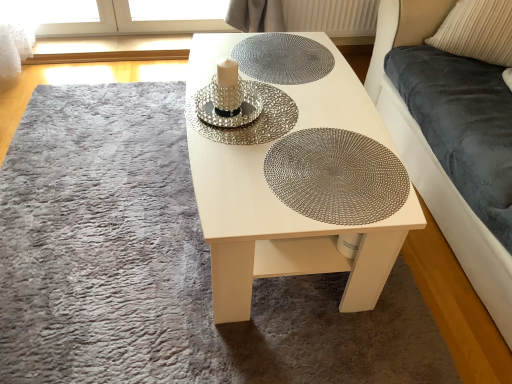
Locate an element on the screen. empty space that is ontop of silver metallic plate at center, the second glass plate from the top (from a real-world perspective) is located at coordinates (248, 104).